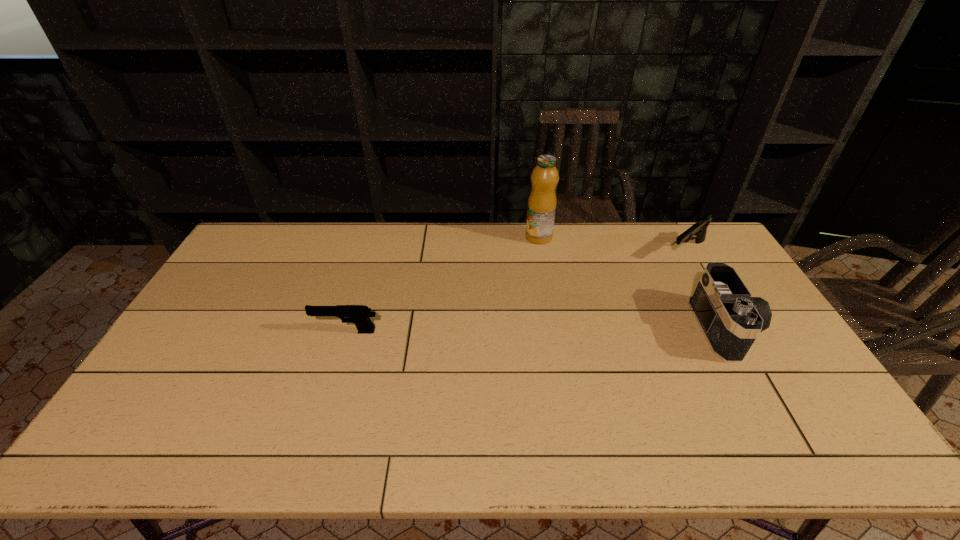
The height and width of the screenshot is (540, 960). Identify the location of free space located 0.340m at the aiming end of the gun. (616, 306).

Where is `free space located at the aiming end of the gun`? The width and height of the screenshot is (960, 540). free space located at the aiming end of the gun is located at coordinates (616, 306).

Image resolution: width=960 pixels, height=540 pixels. Identify the location of vacant space located on the front label of the fruit juice. (527, 306).

Locate an element on the screen. vacant region located 0.330m on the front label of the fruit juice is located at coordinates (527, 308).

I want to click on vacant space situated 0.330m on the front label of the fruit juice, so click(527, 308).

Image resolution: width=960 pixels, height=540 pixels. In order to click on gun that is at the far edge in this screenshot , I will do `click(699, 229)`.

At what (x,y) coordinates should I click in order to perform the action: click on fruit juice at the far edge. Please return your answer as a coordinate pair (x, y). The width and height of the screenshot is (960, 540). Looking at the image, I should click on (542, 201).

The width and height of the screenshot is (960, 540). In order to click on camera located at the right edge in this screenshot , I will do `click(730, 319)`.

Identify the location of gun that is at the right edge. This screenshot has height=540, width=960. (699, 229).

Identify the location of object that is at the far right corner. (699, 229).